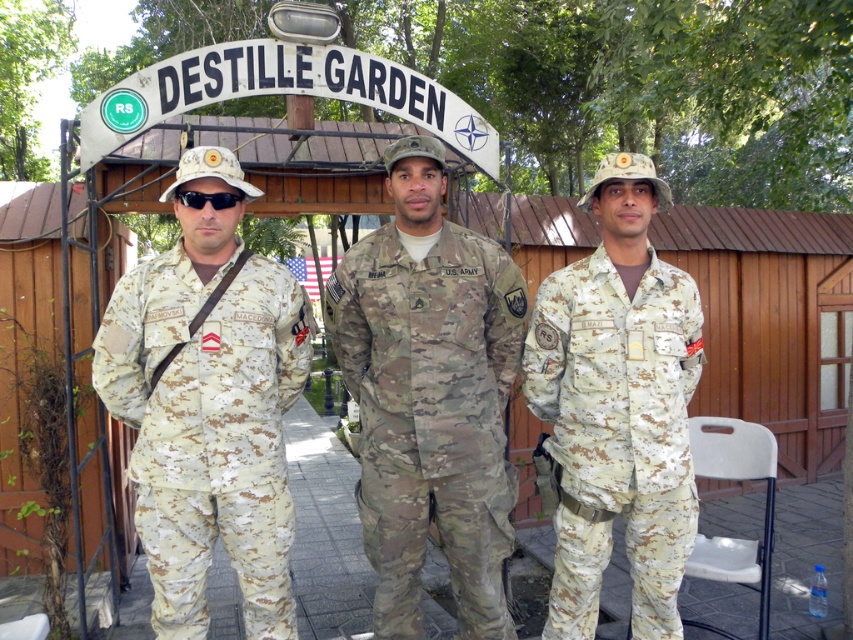
Question: Which point appears farthest from the camera in this image?

Choices:
 (A) (257, 257)
 (B) (665, 532)
 (C) (404, 465)
 (D) (212, 205)

Answer: (A)

Question: Which of the following is the closest to the observer?

Choices:
 (A) (509, 467)
 (B) (224, 209)
 (C) (270, 278)
 (D) (560, 401)

Answer: (B)

Question: Does camouflage fabric uniform at left have a greater width compared to black matte goggles at center?

Choices:
 (A) yes
 (B) no

Answer: (A)

Question: Which point is closer to the camera?

Choices:
 (A) camouflage fabric uniform at left
 (B) multicam uniform at center
 (C) camouflage fabric uniform at center
 (D) black matte goggles at center

Answer: (A)

Question: Does multicam uniform at center have a lesser width compared to black matte goggles at center?

Choices:
 (A) no
 (B) yes

Answer: (A)

Question: Is multicam uniform at center positioned at the back of camouflage fabric uniform at center?

Choices:
 (A) yes
 (B) no

Answer: (B)